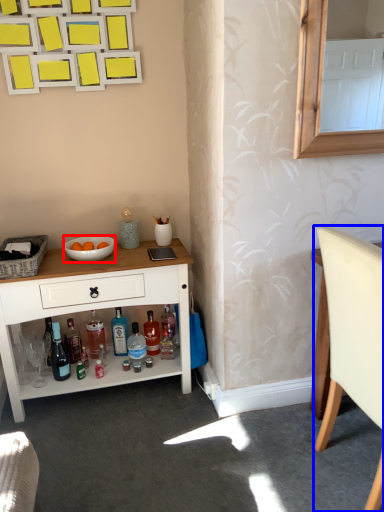
Question: Which of the following is the closest to the observer, bowl (highlighted by a red box) or chair (highlighted by a blue box)?

Choices:
 (A) bowl
 (B) chair

Answer: (B)